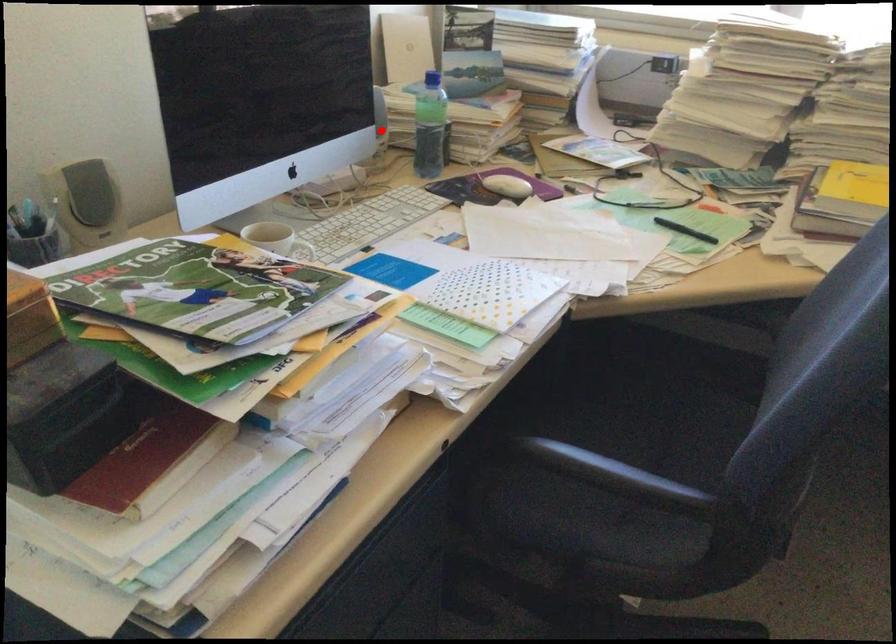
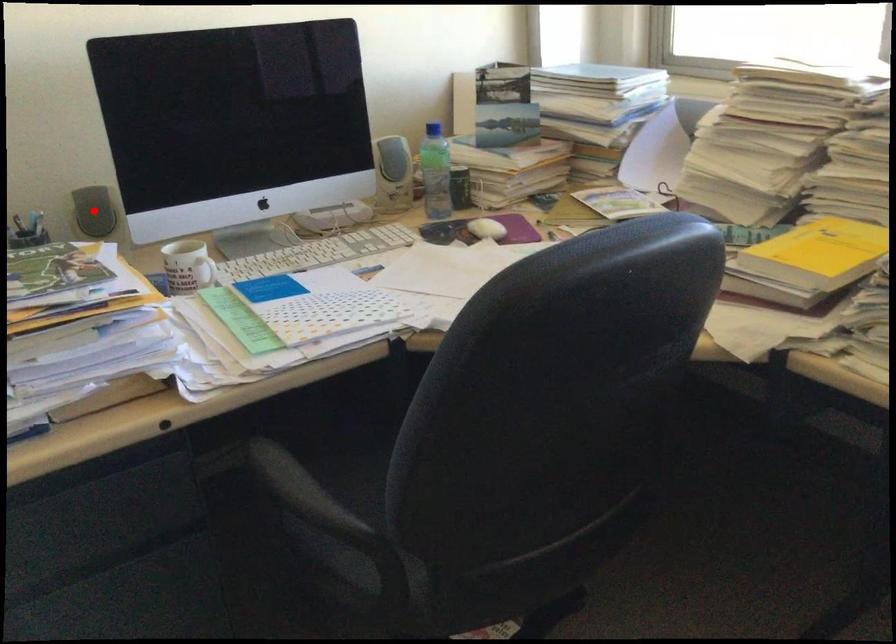
I am providing you with two images of the same scene from different viewpoints. A red point is marked on the first image and another point is marked on the second image. Do the highlighted points in image1 and image2 indicate the same real-world spot?

No